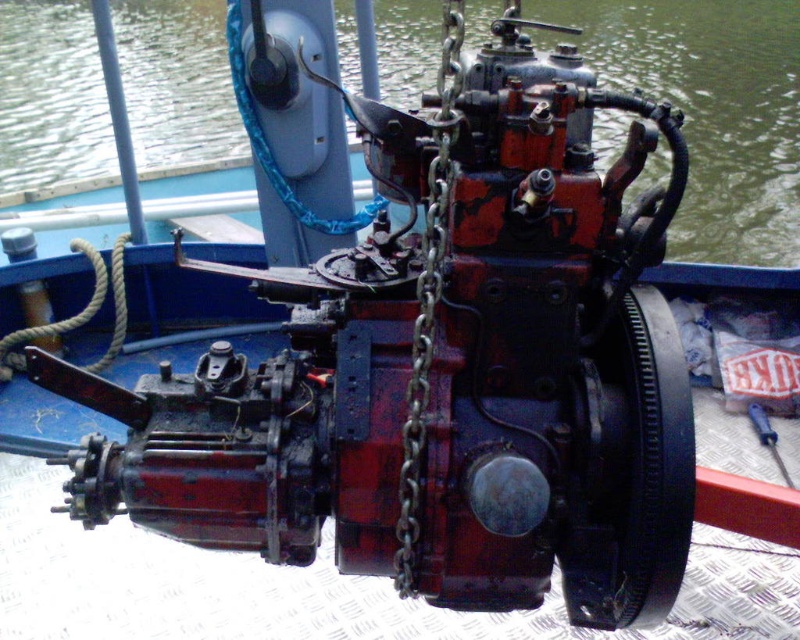
Who is positioned more to the right, rusty metal engine at center or rusty metal chain at center?

From the viewer's perspective, rusty metal engine at center appears more on the right side.

Between point (762, 173) and point (424, 417), which one is positioned in front?

Point (424, 417) is in front.

The image size is (800, 640). What do you see at coordinates (712, 109) in the screenshot? I see `rusty metal engine at center` at bounding box center [712, 109].

This screenshot has height=640, width=800. Identify the location of rusty metal engine at center. (712, 109).